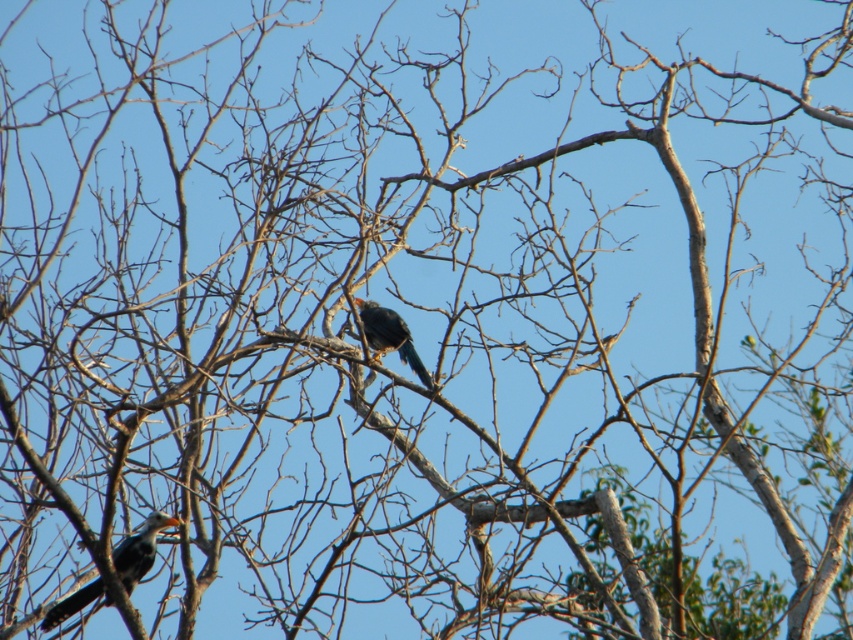
Can you confirm if matte black bird at lower left is smaller than shiny black bird at center?

Actually, matte black bird at lower left might be larger than shiny black bird at center.

Is matte black bird at lower left to the left of shiny black bird at center from the viewer's perspective?

Yes, matte black bird at lower left is to the left of shiny black bird at center.

Between point (155, 524) and point (387, 340), which one is positioned in front?

Point (155, 524) is more forward.

Find the location of a particular element. The height and width of the screenshot is (640, 853). matte black bird at lower left is located at coordinates (138, 548).